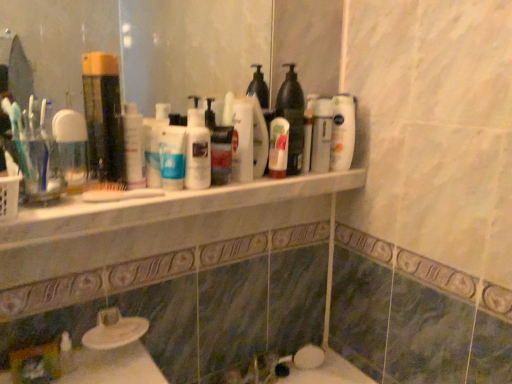
Question: Does translucent plastic mouthwash at left, placed as the 2th mouthwash when sorted from left to right, have a smaller size compared to white glossy lotion at center, which is the first toiletry in right-to-left order?

Choices:
 (A) no
 (B) yes

Answer: (A)

Question: Is white glossy lotion at center, the 1th toiletry in the back-to-front sequence, inside translucent plastic mouthwash at left, placed as the 2th mouthwash when sorted from left to right?

Choices:
 (A) no
 (B) yes

Answer: (A)

Question: From the image's perspective, is translucent plastic mouthwash at left, positioned as the first mouthwash in right-to-left order, above white glossy lotion at center, the second toiletry positioned from the front?

Choices:
 (A) no
 (B) yes

Answer: (B)

Question: Considering the relative sizes of translucent plastic mouthwash at left, placed as the 2th mouthwash when sorted from left to right, and white glossy lotion at center, the second toiletry positioned from the front, in the image provided, is translucent plastic mouthwash at left, placed as the 2th mouthwash when sorted from left to right, bigger than white glossy lotion at center, the second toiletry positioned from the front,?

Choices:
 (A) yes
 (B) no

Answer: (A)

Question: Is translucent plastic mouthwash at left, placed as the 2th mouthwash when sorted from left to right, facing away from white glossy lotion at center, the second toiletry positioned from the front?

Choices:
 (A) no
 (B) yes

Answer: (A)

Question: Does translucent plastic mouthwash at left, placed as the 2th mouthwash when sorted from left to right, come in front of white glossy lotion at center, the second toiletry positioned from the front?

Choices:
 (A) yes
 (B) no

Answer: (A)

Question: Is the surface of white glossy bottle at upper center, the 5th cleaning product viewed from the left, in direct contact with white glossy lotion at center, marked as the 1th toiletry in a front-to-back arrangement?

Choices:
 (A) no
 (B) yes

Answer: (A)

Question: Is white glossy bottle at upper center, marked as the first cleaning product in a right-to-left arrangement, thinner than white glossy lotion at center, the 2th toiletry viewed from the back?

Choices:
 (A) yes
 (B) no

Answer: (B)

Question: From the image's perspective, is white glossy bottle at upper center, marked as the first cleaning product in a right-to-left arrangement, on white glossy lotion at center, the first toiletry when ordered from left to right?

Choices:
 (A) no
 (B) yes

Answer: (B)

Question: Is white glossy bottle at upper center, marked as the first cleaning product in a right-to-left arrangement, taller than white glossy lotion at center, marked as the 1th toiletry in a front-to-back arrangement?

Choices:
 (A) yes
 (B) no

Answer: (A)

Question: Is white glossy bottle at upper center, the 5th cleaning product viewed from the left, turned away from white glossy lotion at center, marked as the second toiletry in a right-to-left arrangement?

Choices:
 (A) no
 (B) yes

Answer: (A)

Question: From a real-world perspective, is white glossy bottle at upper center, the 5th cleaning product viewed from the left, physically below white glossy lotion at center, marked as the 1th toiletry in a front-to-back arrangement?

Choices:
 (A) yes
 (B) no

Answer: (B)

Question: From the image's perspective, does translucent plastic mouthwash at left, placed as the 2th mouthwash when sorted from left to right, appear lower than white marble counter at center?

Choices:
 (A) yes
 (B) no

Answer: (B)